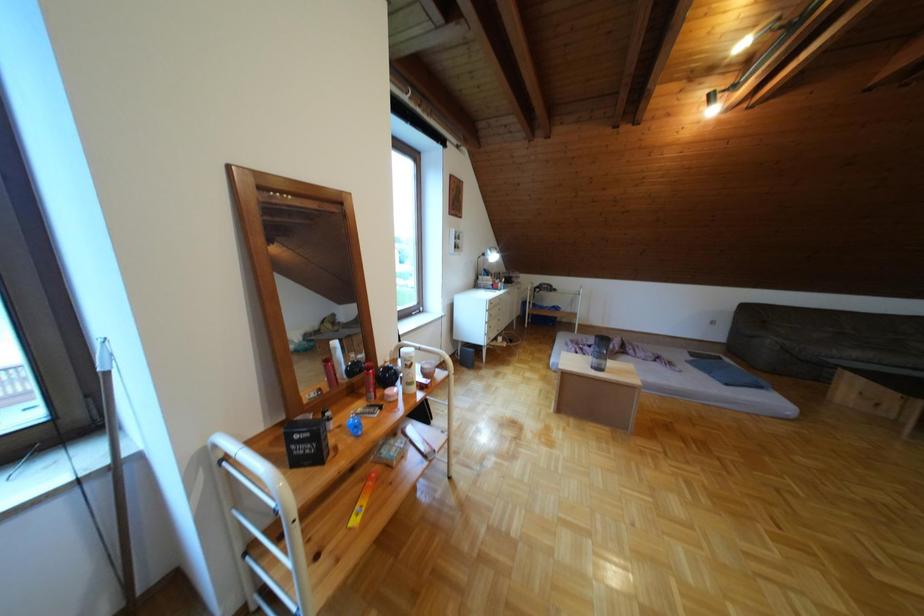
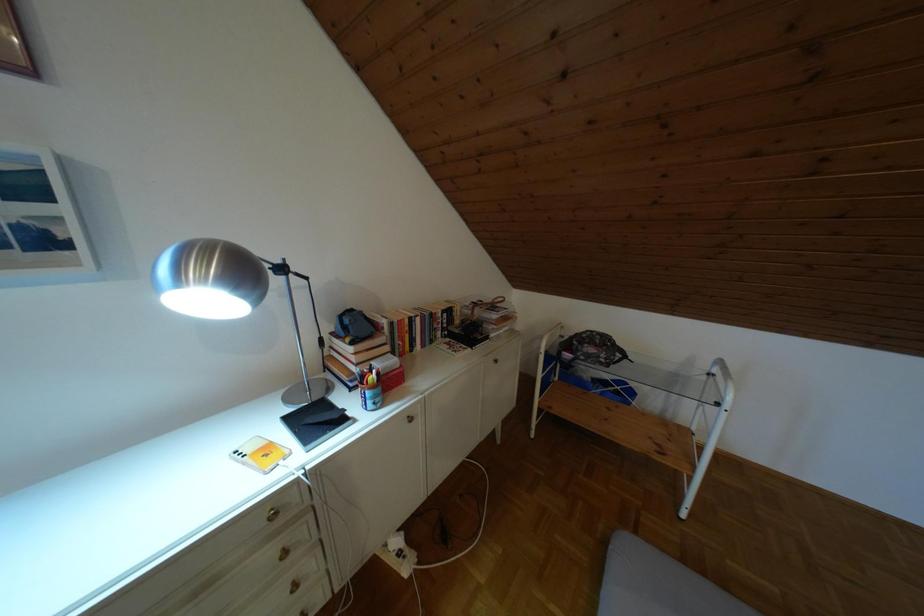
Consider the image. What movement of the cameraman would produce the second image?

The cameraman moved toward right, forward.